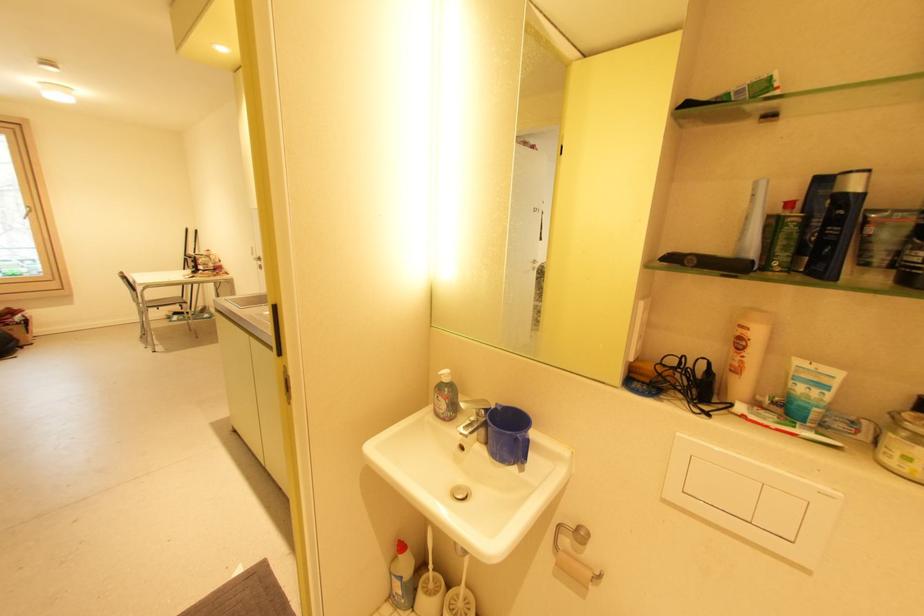
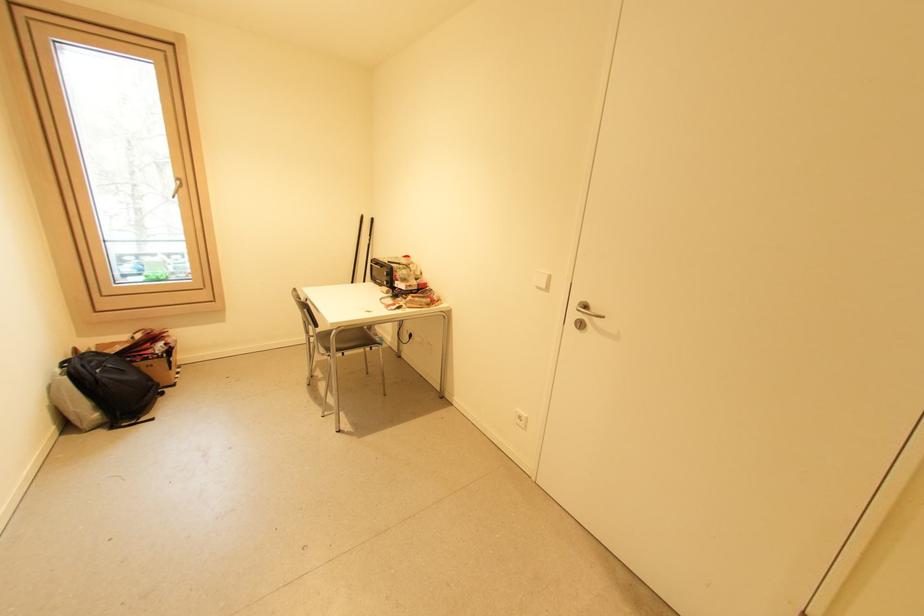
In a continuous first-person perspective shot, in which direction is the camera moving?

The movement direction of the cameraman is left, forward.